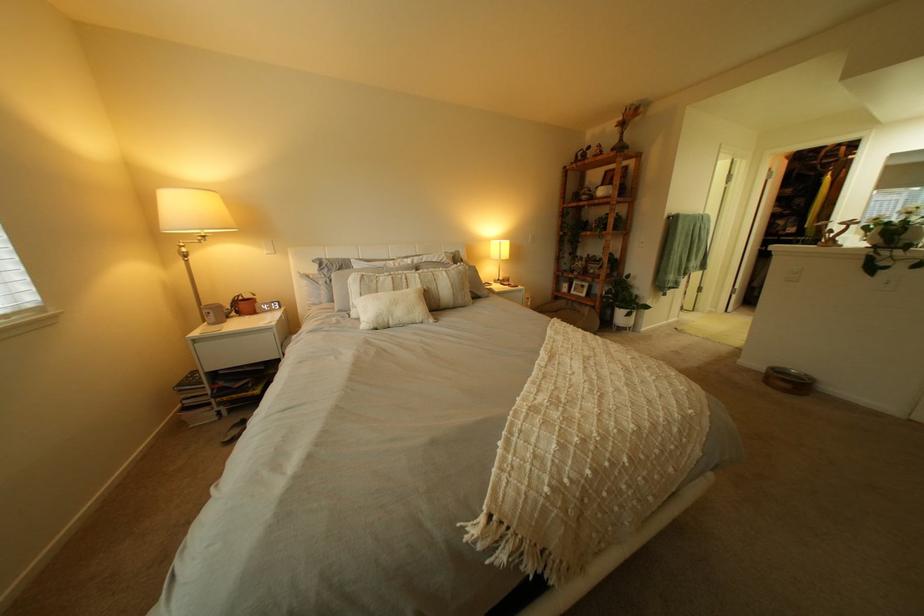
The width and height of the screenshot is (924, 616). Describe the element at coordinates (191, 222) in the screenshot. I see `the small table lamp` at that location.